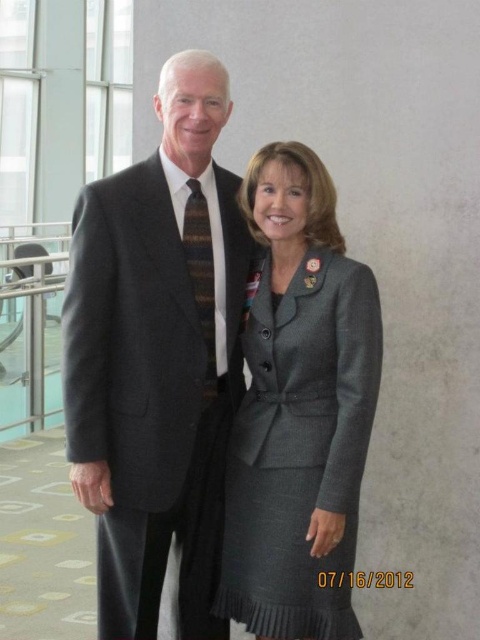
You are a photographer standing at the camera position. You want to take a photo of the two people in the scene. The focus point of your camera is set to point (182, 532). The minimum focus distance of your camera is 3 meters. Will the two people be in focus?

The distance of point (182, 532) from the camera is 3.27 meters, which is beyond the minimum focus distance of 3 meters. Therefore, the two people will be in focus.